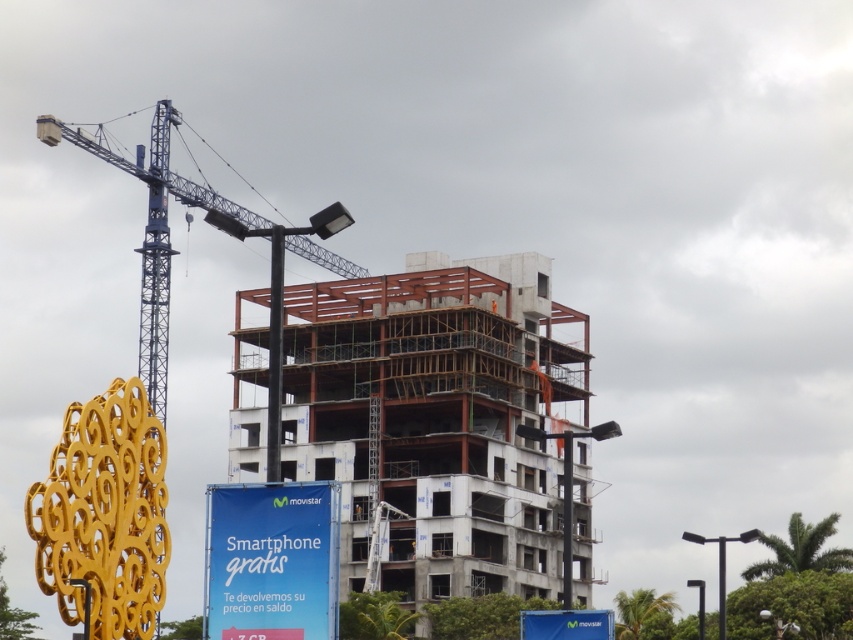
Can you confirm if blue fabric sign at lower center is shorter than blue metallic crane at upper left?

Yes, blue fabric sign at lower center is shorter than blue metallic crane at upper left.

In the scene shown: Is blue fabric sign at lower center closer to camera compared to blue metallic crane at upper left?

No.

Is point (296, 493) farther from viewer compared to point (90, 150)?

No.

Find the location of a particular element. The height and width of the screenshot is (640, 853). blue fabric sign at lower center is located at coordinates (271, 561).

Is point (410, 548) more distant than point (322, 628)?

Yes, it is.

Which is in front, point (302, 304) or point (291, 586)?

Point (291, 586)

Which is behind, point (531, 406) or point (326, 532)?

The point (531, 406) is more distant.

Find the location of a particular element. The image size is (853, 640). white concrete building at center is located at coordinates (437, 419).

Is white concrete building at center thinner than blue metallic crane at upper left?

No.

Is white concrete building at center further to the viewer compared to blue metallic crane at upper left?

Yes, it is behind blue metallic crane at upper left.

What do you see at coordinates (437, 419) in the screenshot? This screenshot has height=640, width=853. I see `white concrete building at center` at bounding box center [437, 419].

Image resolution: width=853 pixels, height=640 pixels. I want to click on white concrete building at center, so click(437, 419).